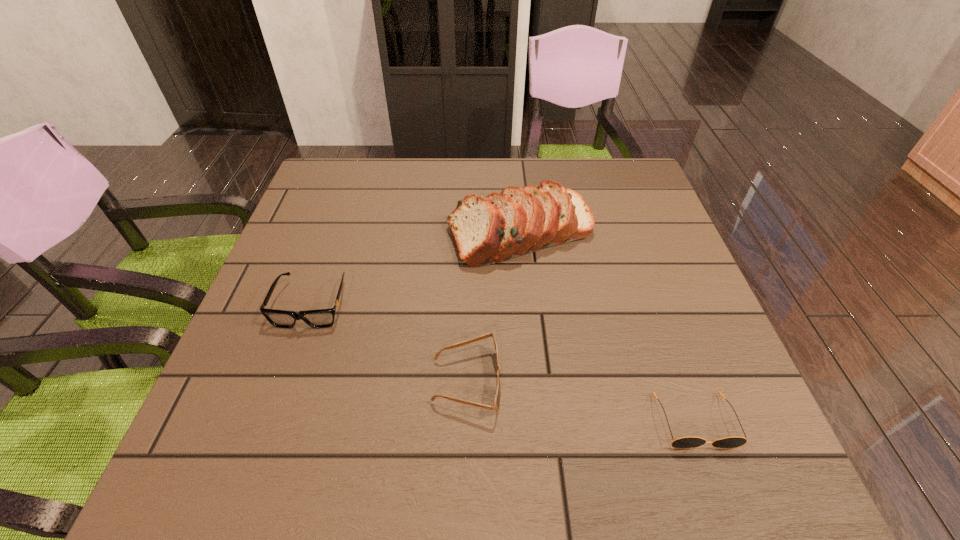
In the image, there is a desktop. Where is `blank space at the far right corner`? blank space at the far right corner is located at coordinates (615, 170).

Locate an element on the screen. This screenshot has height=540, width=960. vacant region between the shortest object and the farthest object is located at coordinates (608, 326).

Identify the location of free space that is in between the second sunglasses from left to right and the farthest object. (493, 306).

Identify the location of vacant area that lies between the second sunglasses from right to left and the shortest sunglasses. (581, 401).

Locate an element on the screen. Image resolution: width=960 pixels, height=540 pixels. free space between the rightmost object and the second sunglasses from right to left is located at coordinates (581, 401).

At what (x,y) coordinates should I click in order to perform the action: click on free area in between the shortest object and the bread. Please return your answer as a coordinate pair (x, y). This screenshot has height=540, width=960. Looking at the image, I should click on (608, 326).

I want to click on free space that is in between the second sunglasses from right to left and the shortest object, so click(x=581, y=401).

Identify the location of vacant space in between the third nearest object and the shortest object. The height and width of the screenshot is (540, 960). (503, 362).

At what (x,y) coordinates should I click in order to perform the action: click on vacant area that lies between the farthest object and the second sunglasses from left to right. Please return your answer as a coordinate pair (x, y). Looking at the image, I should click on (493, 306).

Identify the location of free spot between the leftmost sunglasses and the rightmost object. (503, 362).